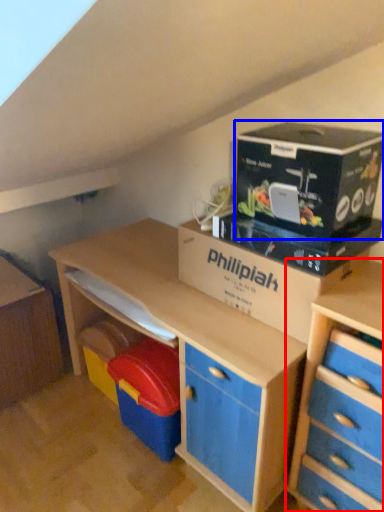
Question: Which object appears closest to the camera in this image, chest of drawers (highlighted by a red box) or cardboard (highlighted by a blue box)?

Choices:
 (A) chest of drawers
 (B) cardboard

Answer: (A)